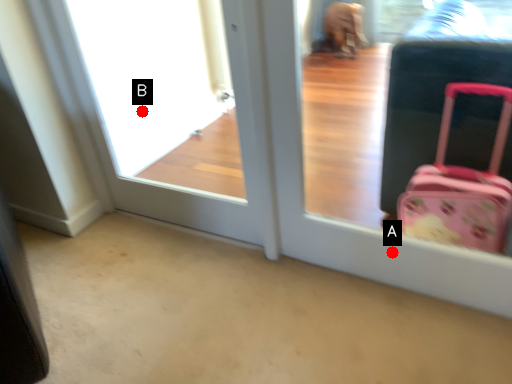
Question: Two points are circled on the image, labeled by A and B beside each circle. Which of the following is the closest to the observer?

Choices:
 (A) A is closer
 (B) B is closer

Answer: (A)